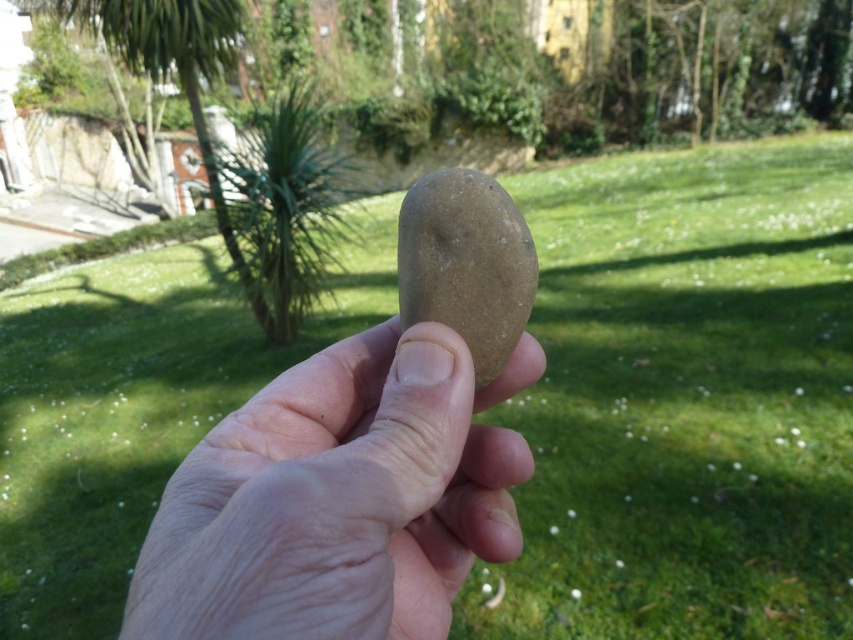
Question: Which of the following is the closest to the observer?

Choices:
 (A) green leafy palm tree at center
 (B) smooth brown stone at center
 (C) smooth beige stone at center

Answer: (C)

Question: Is smooth beige stone at center wider than smooth brown stone at center?

Choices:
 (A) no
 (B) yes

Answer: (B)

Question: Which of the following is the closest to the observer?

Choices:
 (A) (425, 563)
 (B) (331, 240)

Answer: (A)

Question: Among these objects, which one is nearest to the camera?

Choices:
 (A) smooth brown stone at center
 (B) smooth beige stone at center
 (C) green leafy palm tree at center

Answer: (B)

Question: Can you confirm if smooth beige stone at center is positioned to the left of green leafy palm tree at center?

Choices:
 (A) no
 (B) yes

Answer: (A)

Question: Does smooth beige stone at center have a lesser width compared to smooth brown stone at center?

Choices:
 (A) no
 (B) yes

Answer: (A)